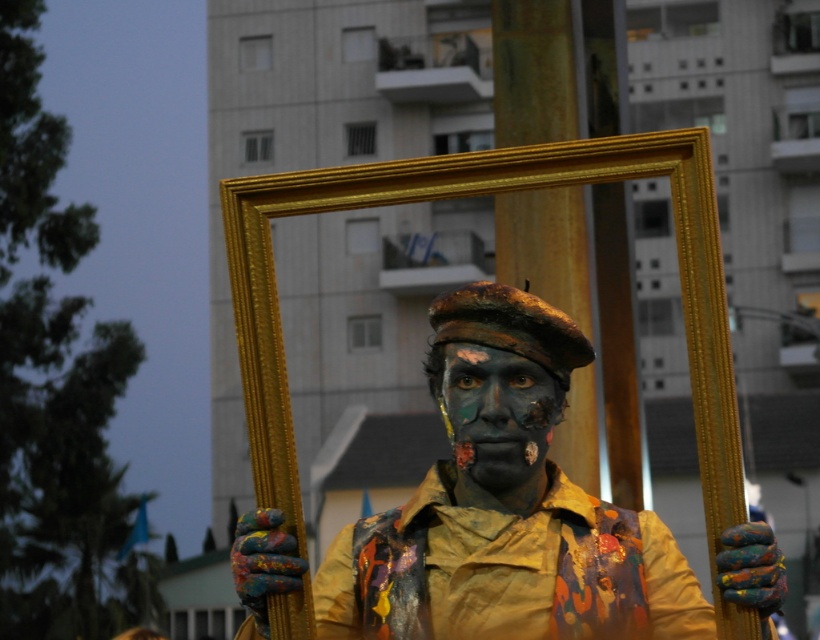
You are a photographer trying to capture the entire figure of the painted fabric street artist at center and the painted skin face at center in one shot. Based on the scene description, which object should you focus on first to ensure both are in frame?

The painted fabric street artist at center is much taller than the painted skin face at center, so you should focus on the painted fabric street artist at center first to ensure both are in frame.

In the scene shown: You are a city planner reviewing a public space design. The design includes a statue of a painted fabric street artist at center located at point (504, 506). If you want to place a bench nearby for people to rest, where should it be positioned relative to the statue to ensure visibility and accessibility?

The bench should be placed near the painted fabric street artist at center at point (504, 506), ensuring it is within sight and close enough for easy access, but not blocking the view of the statue.